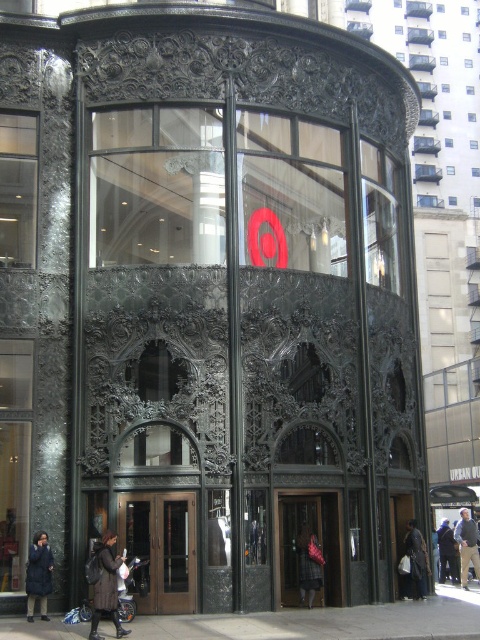
Question: Can you confirm if metallic silver baby carriage at lower center is positioned to the right of dark gray coat at center?

Choices:
 (A) yes
 (B) no

Answer: (B)

Question: Which of the following is the closest to the observer?

Choices:
 (A) (156, 602)
 (B) (110, 608)
 (C) (132, 605)
 (D) (279, 534)

Answer: (B)

Question: Can you confirm if dark brown leather coat at lower left is bigger than dark blue coat at lower left?

Choices:
 (A) no
 (B) yes

Answer: (B)

Question: Which object appears farthest from the camera in this image?

Choices:
 (A) dark blue coat at lower left
 (B) dark gray jacket at center
 (C) metallic silver baby carriage at lower center
 (D) dark gray coat at center

Answer: (D)

Question: Does plaid wool coat at center have a smaller size compared to dark gray jacket at center?

Choices:
 (A) no
 (B) yes

Answer: (B)

Question: Which of the following is the closest to the observer?

Choices:
 (A) (327, 500)
 (B) (477, 552)

Answer: (A)